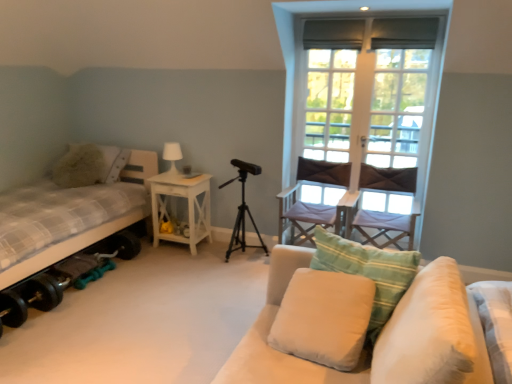
Question: From a real-world perspective, is fluffy beige pillow at left, which ranks as the 4th pillow in right-to-left order, positioned over white wood window at upper right based on gravity?

Choices:
 (A) no
 (B) yes

Answer: (A)

Question: Is fluffy beige pillow at left, the fourth pillow when ordered from front to back, thinner than white wood window at upper right?

Choices:
 (A) no
 (B) yes

Answer: (A)

Question: From the image's perspective, is fluffy beige pillow at left, the fourth pillow when ordered from front to back, located above white wood window at upper right?

Choices:
 (A) no
 (B) yes

Answer: (A)

Question: Could you tell me if fluffy beige pillow at left, positioned as the 1th pillow in left-to-right order, is facing white wood window at upper right?

Choices:
 (A) yes
 (B) no

Answer: (B)

Question: Is fluffy beige pillow at left, the fourth pillow when ordered from front to back, positioned in front of white wood window at upper right?

Choices:
 (A) yes
 (B) no

Answer: (B)

Question: Considering the positions of black matte tripod at center and soft beige fabric couch at lower right in the image, is black matte tripod at center taller or shorter than soft beige fabric couch at lower right?

Choices:
 (A) tall
 (B) short

Answer: (A)

Question: From the image's perspective, is black matte tripod at center located above or below soft beige fabric couch at lower right?

Choices:
 (A) below
 (B) above

Answer: (B)

Question: Considering the positions of black matte tripod at center and soft beige fabric couch at lower right in the image, is black matte tripod at center bigger or smaller than soft beige fabric couch at lower right?

Choices:
 (A) small
 (B) big

Answer: (A)

Question: Considering their positions, is black matte tripod at center located in front of or behind soft beige fabric couch at lower right?

Choices:
 (A) behind
 (B) front

Answer: (A)

Question: Looking at their shapes, would you say black matte tripod at center is wider or thinner than light beige fabric pillow at center, the 2th pillow in the back-to-front sequence?

Choices:
 (A) wide
 (B) thin

Answer: (A)

Question: Is black matte tripod at center inside the boundaries of light beige fabric pillow at center, placed as the third pillow when sorted from front to back, or outside?

Choices:
 (A) outside
 (B) inside

Answer: (A)

Question: Is black matte tripod at center taller or shorter than light beige fabric pillow at center, acting as the 3th pillow starting from the left?

Choices:
 (A) short
 (B) tall

Answer: (B)

Question: Considering the positions of point (243, 180) and point (375, 304), is point (243, 180) closer or farther from the camera than point (375, 304)?

Choices:
 (A) farther
 (B) closer

Answer: (A)

Question: Does point (305, 326) appear closer or farther from the camera than point (394, 175)?

Choices:
 (A) closer
 (B) farther

Answer: (A)

Question: Considering the relative positions of white soft cushion at center, which is the second pillow from left to right, and light purple fabric chair at center right, which is the second chair from left to right, in the image provided, is white soft cushion at center, which is the second pillow from left to right, to the left or to the right of light purple fabric chair at center right, which is the second chair from left to right,?

Choices:
 (A) left
 (B) right

Answer: (A)